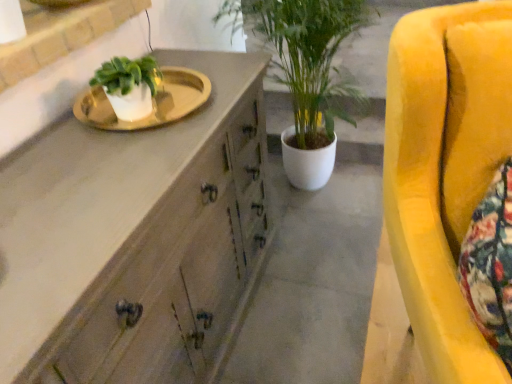
Question: Considering the positions of wooden cabinet at center and white glossy sink at upper left in the image, is wooden cabinet at center bigger or smaller than white glossy sink at upper left?

Choices:
 (A) small
 (B) big

Answer: (B)

Question: From a real-world perspective, is wooden cabinet at center positioned above or below white glossy sink at upper left?

Choices:
 (A) above
 (B) below

Answer: (B)

Question: Based on their relative distances, which object is nearer to the white glossy sink at upper left?

Choices:
 (A) velvet yellow armchair at right
 (B) wooden cabinet at center
 (C) concreteroughcabinet at center

Answer: (B)

Question: Based on their relative distances, which object is farther from the white glossy sink at upper left?

Choices:
 (A) wooden cabinet at center
 (B) concreteroughcabinet at center
 (C) velvet yellow armchair at right

Answer: (B)